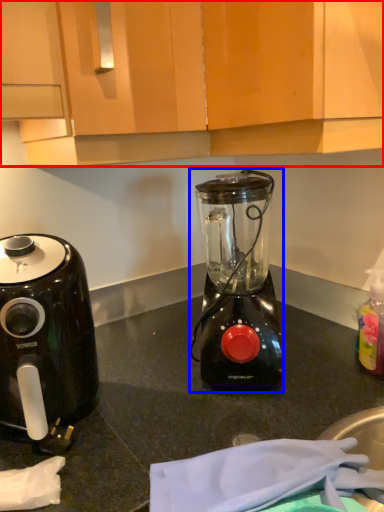
Question: Among these objects, which one is farthest to the camera, cabinetry (highlighted by a red box) or blender (highlighted by a blue box)?

Choices:
 (A) cabinetry
 (B) blender

Answer: (B)